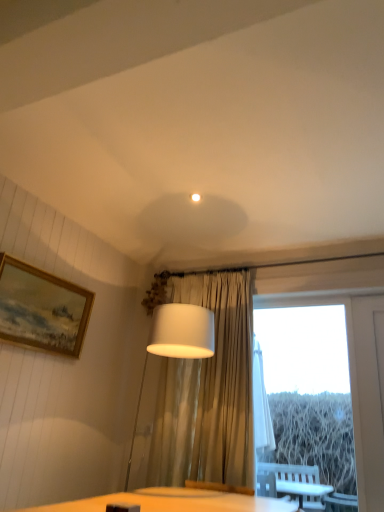
Question: Does transparent glass window at center have a lesser height compared to white fabric lampshade at center?

Choices:
 (A) no
 (B) yes

Answer: (A)

Question: Are transparent glass window at center and white fabric lampshade at center making contact?

Choices:
 (A) yes
 (B) no

Answer: (B)

Question: Would you consider transparent glass window at center to be distant from white fabric lampshade at center?

Choices:
 (A) yes
 (B) no

Answer: (A)

Question: Is transparent glass window at center aimed at white fabric lampshade at center?

Choices:
 (A) no
 (B) yes

Answer: (B)

Question: From the image's perspective, would you say transparent glass window at center is shown under white fabric lampshade at center?

Choices:
 (A) yes
 (B) no

Answer: (A)

Question: Considering the positions of gold-framed painting at upper left and transparent glass window at center in the image, is gold-framed painting at upper left taller or shorter than transparent glass window at center?

Choices:
 (A) short
 (B) tall

Answer: (A)

Question: Which is correct: gold-framed painting at upper left is inside transparent glass window at center, or outside of it?

Choices:
 (A) inside
 (B) outside

Answer: (B)

Question: Visually, is gold-framed painting at upper left positioned to the left or to the right of transparent glass window at center?

Choices:
 (A) right
 (B) left

Answer: (B)

Question: From a real-world perspective, is gold-framed painting at upper left positioned above or below transparent glass window at center?

Choices:
 (A) above
 (B) below

Answer: (A)

Question: From a real-world perspective, is white fabric lampshade at center above or below gold-framed painting at upper left?

Choices:
 (A) below
 (B) above

Answer: (A)

Question: Would you say white fabric lampshade at center is inside or outside gold-framed painting at upper left?

Choices:
 (A) outside
 (B) inside

Answer: (A)

Question: Considering the relative positions of white fabric lampshade at center and gold-framed painting at upper left in the image provided, is white fabric lampshade at center to the left or to the right of gold-framed painting at upper left?

Choices:
 (A) left
 (B) right

Answer: (B)

Question: In terms of height, does white fabric lampshade at center look taller or shorter compared to gold-framed painting at upper left?

Choices:
 (A) tall
 (B) short

Answer: (A)

Question: In the image, is transparent glass window at center positioned in front of or behind white fabric lampshade at center?

Choices:
 (A) front
 (B) behind

Answer: (B)

Question: From the image's perspective, is transparent glass window at center positioned above or below white fabric lampshade at center?

Choices:
 (A) below
 (B) above

Answer: (A)